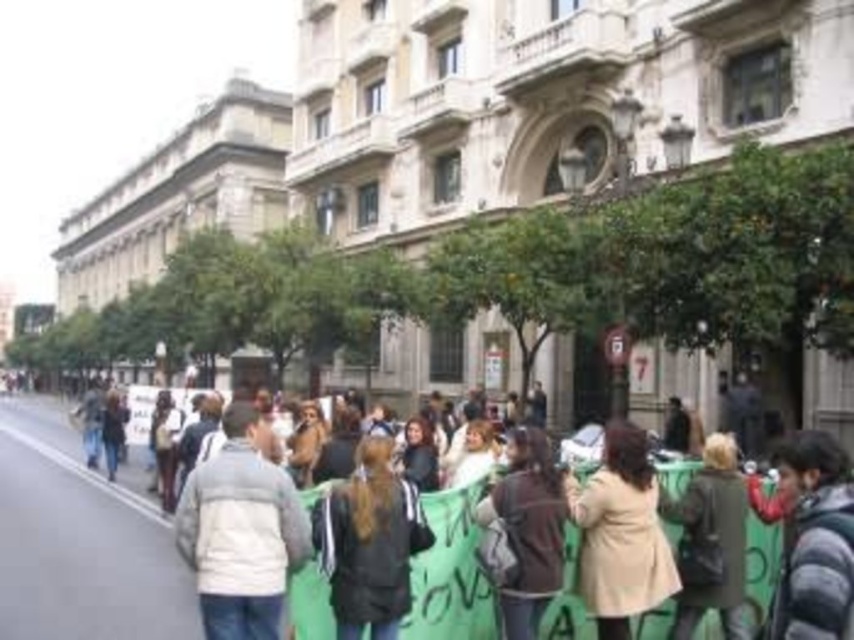
You are a photographer trying to capture the protest scene. You notice a point at coordinates (449, 570). What object is this point located on?

The point at coordinates (449, 570) is located on the green fabric banner at center.

You are a photographer standing on the gray asphalt at lower left, aiming to capture the light gray fleece jacket at center in your shot. Can you see the entire jacket in the frame if you adjust your angle? Please explain using the height difference between the two objects.

The gray asphalt at lower left is shorter than the light gray fleece jacket at center. Since the asphalt is lower, you can adjust your angle upward to ensure the entire jacket is visible in the frame.